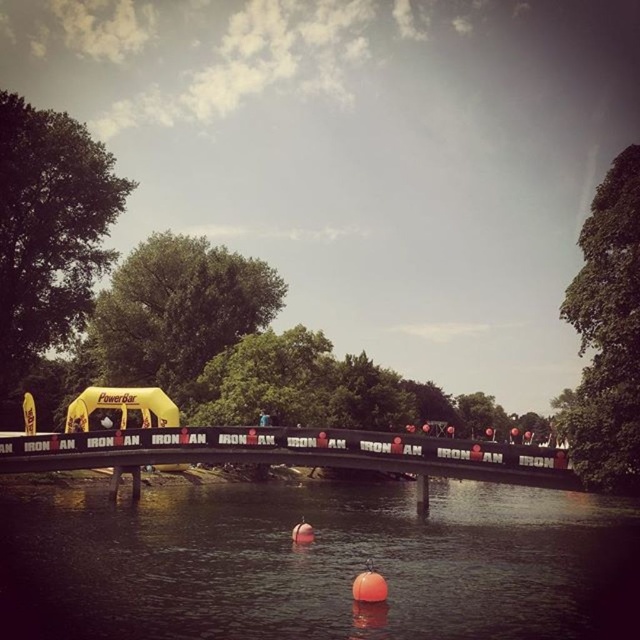
Is black fabric tent at center wider than black metal bridge at center?

Indeed, black fabric tent at center has a greater width compared to black metal bridge at center.

Does black fabric tent at center have a larger size compared to black metal bridge at center?

Indeed, black fabric tent at center has a larger size compared to black metal bridge at center.

This screenshot has height=640, width=640. I want to click on black fabric tent at center, so click(x=332, y=378).

Where is `black fabric tent at center`? Image resolution: width=640 pixels, height=640 pixels. black fabric tent at center is located at coordinates (332, 378).

Between transparent plastic buoys at lower center and black metal bridge at center, which one is positioned higher?

black metal bridge at center is above.

Can you confirm if transparent plastic buoys at lower center is wider than black metal bridge at center?

Yes.

Where is `transparent plastic buoys at lower center`? The image size is (640, 640). transparent plastic buoys at lower center is located at coordinates (316, 563).

Does black fabric tent at center have a lesser height compared to transparent plastic buoys at lower center?

No.

Does black fabric tent at center have a larger size compared to transparent plastic buoys at lower center?

Correct, black fabric tent at center is larger in size than transparent plastic buoys at lower center.

Looking at this image, who is more forward, (180,355) or (72,584)?

Point (72,584) is in front.

Image resolution: width=640 pixels, height=640 pixels. I want to click on black fabric tent at center, so (332, 378).